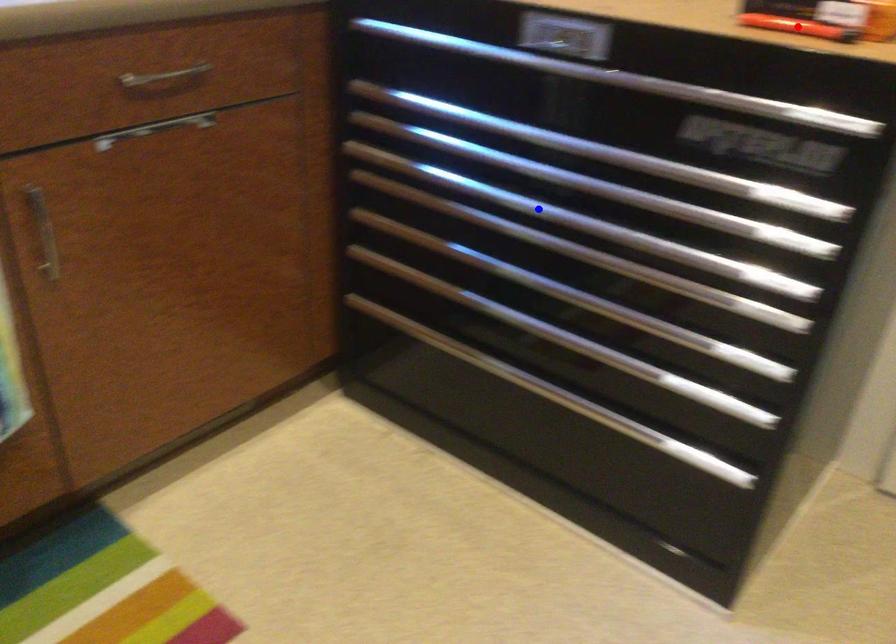
Question: Two points are marked on the image. Which point is closer to the camera?

Choices:
 (A) Blue point is closer.
 (B) Red point is closer.

Answer: (B)